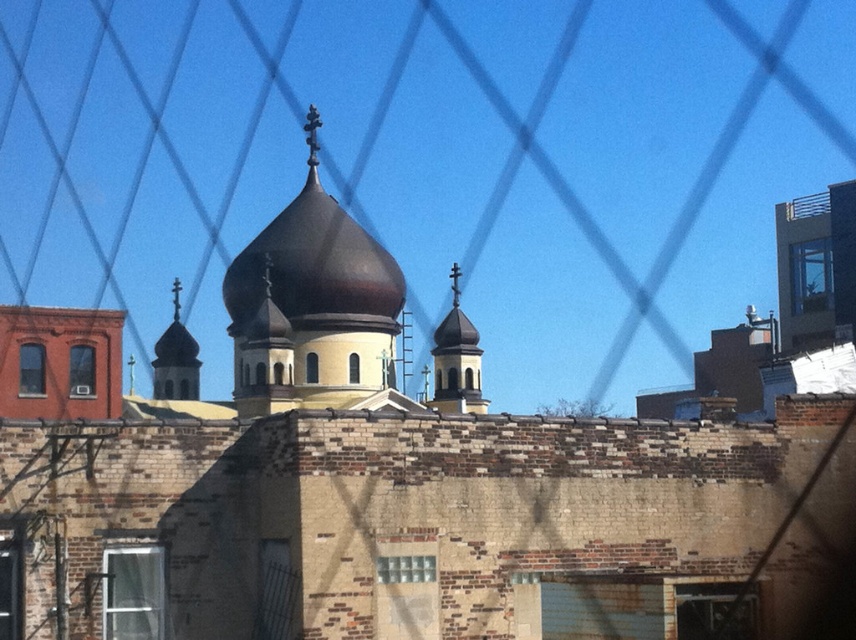
You are standing outside the chainlink fence looking at the shiny brown dome at center and the matte gold dome at left. Which dome is closer to you?

The shiny brown dome at center is closer to you because it is in front of the matte gold dome at left.

You are an architect analyzing the cityscape through the chain link fence. You notice the shiny brown dome at center and the matte gold dome at left. Which dome appears taller when viewed from your current position?

The shiny brown dome at center appears taller than the matte gold dome at left because it has a greater height compared to it.

You are standing in front of the chainlink fence and want to take a photo of the shiny brown dome at center. Based on its position, where should you aim your camera to capture it?

The shiny brown dome at center is located at point 0.416 on the x axis and 0.369 on the y axis, so you should aim your camera at those coordinates to capture it.